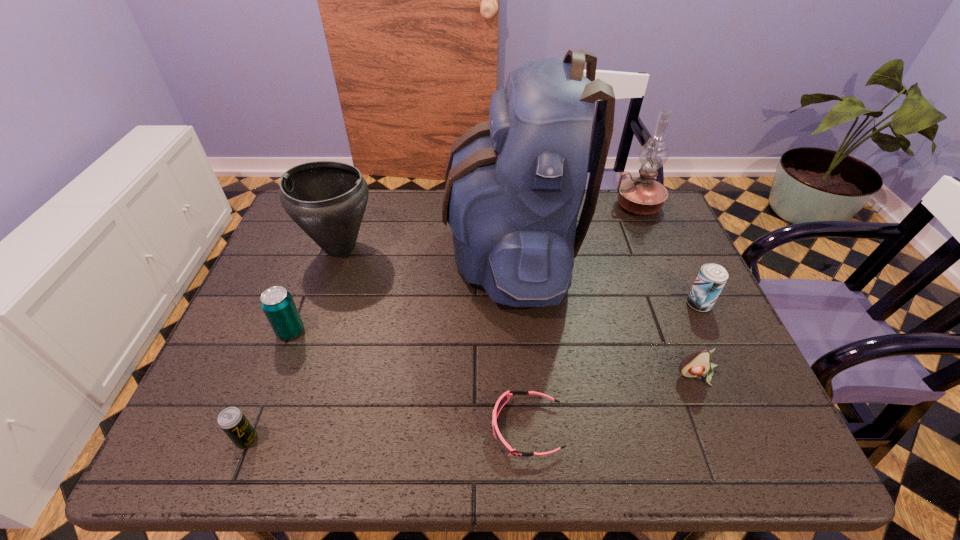
Find the location of a particular element. free space between the rightmost beer can and the backpack is located at coordinates (605, 277).

The width and height of the screenshot is (960, 540). What are the coordinates of `free space between the avocado and the second nearest beer can` in the screenshot? It's located at (493, 354).

You are a GUI agent. You are given a task and a screenshot of the screen. Output one action in this format:
    pyautogui.click(x=<x>, y=<y>)
    Task: Click on the free space between the urn and the goggles
    
    Given the screenshot: What is the action you would take?
    pyautogui.click(x=434, y=338)

Locate an element on the screen. This screenshot has width=960, height=540. vacant point located between the second nearest beer can and the avocado is located at coordinates (493, 354).

Where is `unoccupied area between the urn and the shortest object`? The width and height of the screenshot is (960, 540). unoccupied area between the urn and the shortest object is located at coordinates (434, 338).

At what (x,y) coordinates should I click in order to perform the action: click on free space between the backpack and the goggles. Please return your answer as a coordinate pair (x, y). The image size is (960, 540). Looking at the image, I should click on (518, 339).

Identify which object is the nearest to the shortest beer can. Please provide its 2D coordinates. Your answer should be formatted as a tuple, i.e. [(x, y)], where the tuple contains the x and y coordinates of a point satisfying the conditions above.

[(277, 303)]

You are a GUI agent. You are given a task and a screenshot of the screen. Output one action in this format:
    pyautogui.click(x=<x>, y=<y>)
    Task: Click on the sixth closest object to the sixth farthest object
    This screenshot has height=540, width=960.
    Given the screenshot: What is the action you would take?
    pyautogui.click(x=277, y=303)

Select which beer can appears as the second closest to the rightmost beer can. Please provide its 2D coordinates. Your answer should be formatted as a tuple, i.e. [(x, y)], where the tuple contains the x and y coordinates of a point satisfying the conditions above.

[(232, 421)]

Locate which beer can ranks in proximity to the tallest object. Please provide its 2D coordinates. Your answer should be formatted as a tuple, i.e. [(x, y)], where the tuple contains the x and y coordinates of a point satisfying the conditions above.

[(711, 279)]